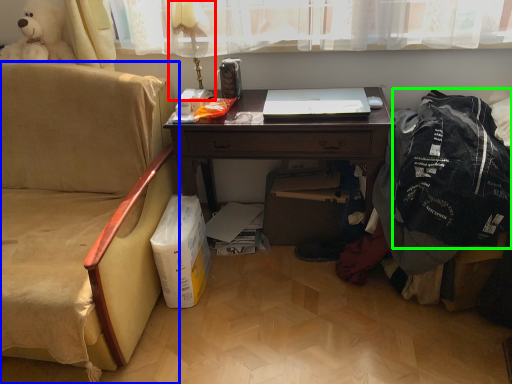
Question: Which object is the closest to the table lamp (highlighted by a red box)? Choose among these: chair (highlighted by a blue box) or clothing (highlighted by a green box).

Choices:
 (A) chair
 (B) clothing

Answer: (A)